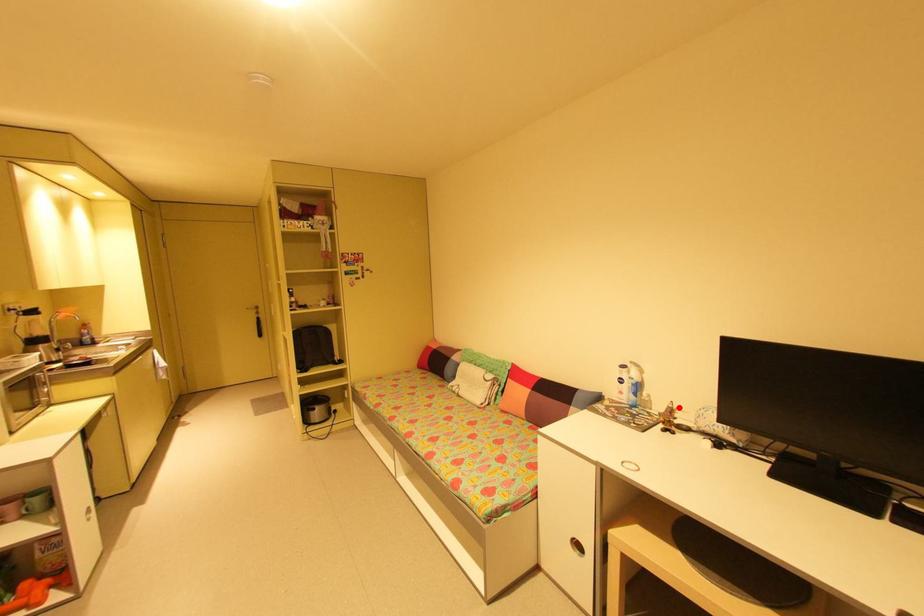
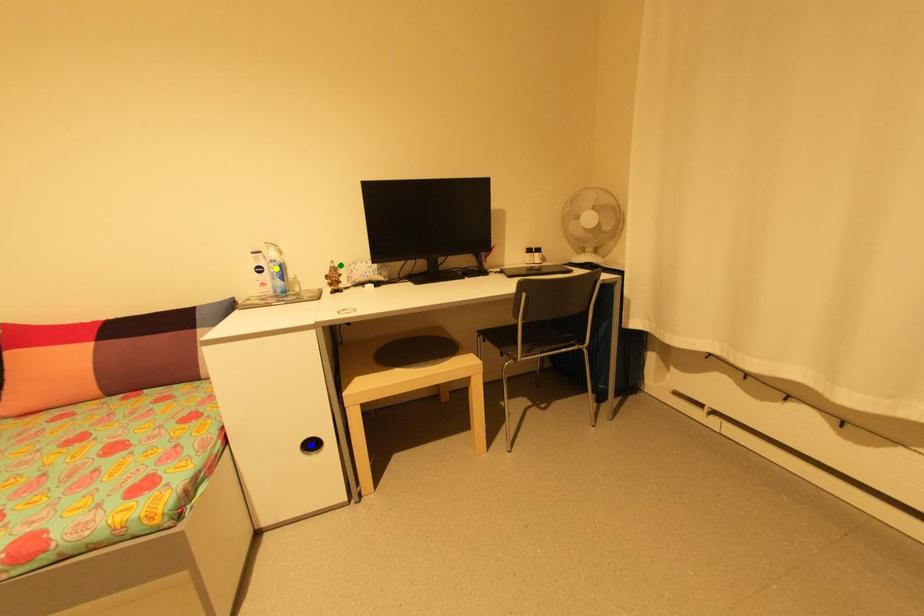
Question: I am providing you with two images of the same scene from different viewpoints. A red point is marked on the first image. You are given multiple points on the second image. Which point in image 2 represents the same 3d spot as the red point in image 1?

Choices:
 (A) blue point
 (B) green point
 (C) yellow point

Answer: (B)